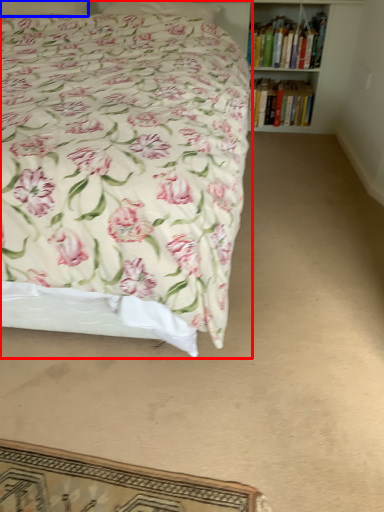
Question: Which object appears farthest to the camera in this image, bed (highlighted by a red box) or pillow (highlighted by a blue box)?

Choices:
 (A) bed
 (B) pillow

Answer: (B)